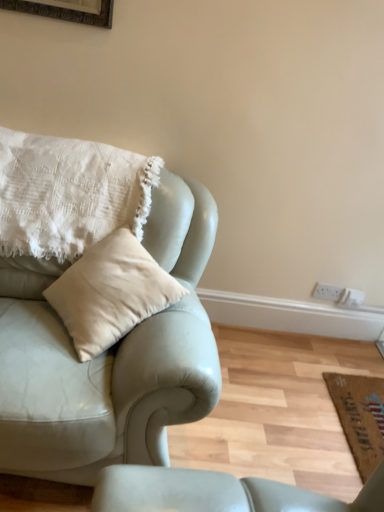
Question: Is white textured pillow at upper left inside or outside of brown woven mat at lower right?

Choices:
 (A) inside
 (B) outside

Answer: (B)

Question: Considering the positions of point (x=49, y=208) and point (x=375, y=407), is point (x=49, y=208) closer or farther from the camera than point (x=375, y=407)?

Choices:
 (A) closer
 (B) farther

Answer: (A)

Question: Estimate the real-world distances between objects in this image. Which object is closer to the white textured pillow at upper left?

Choices:
 (A) matte leather couch at left
 (B) brown woven mat at lower right

Answer: (A)

Question: Which object is the closest to the matte leather couch at left?

Choices:
 (A) white textured pillow at upper left
 (B) brown woven mat at lower right

Answer: (A)